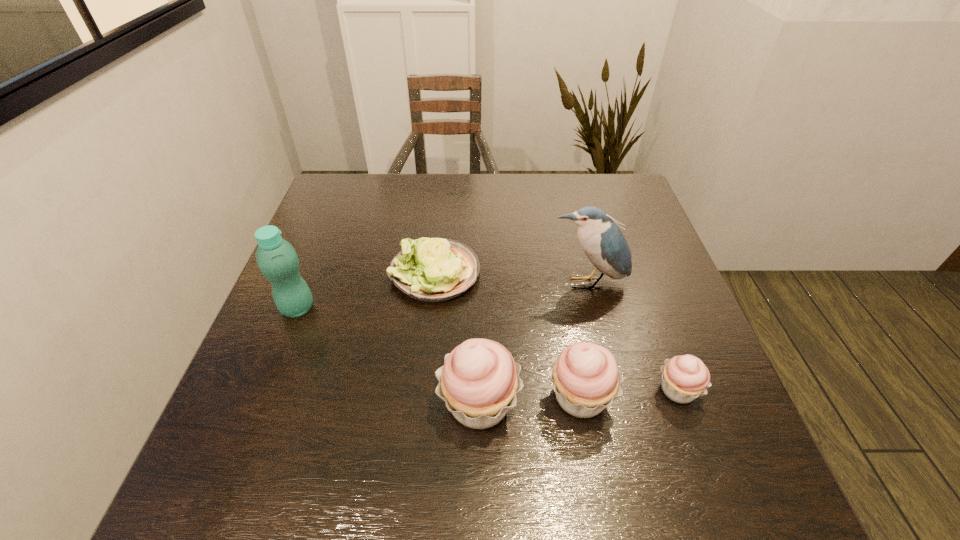
Locate an element on the screen. The width and height of the screenshot is (960, 540). vacant space at the left edge is located at coordinates tap(300, 255).

In the image, there is a desktop. Identify the location of vacant space at the right edge. (634, 224).

In order to click on vacant space at the far left corner in this screenshot , I will do `click(347, 190)`.

In the image, there is a desktop. In order to click on vacant space at the far right corner in this screenshot , I will do `click(593, 203)`.

The image size is (960, 540). I want to click on vacant space at the near right corner, so click(714, 433).

This screenshot has width=960, height=540. Find the location of `vacant space that's between the second tallest cupcake and the leftmost object`. vacant space that's between the second tallest cupcake and the leftmost object is located at coordinates (439, 352).

At what (x,y) coordinates should I click in order to perform the action: click on blank region between the leftmost object and the second shortest cupcake. Please return your answer as a coordinate pair (x, y). The height and width of the screenshot is (540, 960). Looking at the image, I should click on (439, 352).

Where is `empty space between the second cupcake from left to right and the shortest object`? The height and width of the screenshot is (540, 960). empty space between the second cupcake from left to right and the shortest object is located at coordinates (507, 335).

At what (x,y) coordinates should I click in order to perform the action: click on vacant area that lies between the lettuce and the shortest cupcake. Please return your answer as a coordinate pair (x, y). The width and height of the screenshot is (960, 540). Looking at the image, I should click on (557, 332).

In order to click on vacant space that is in between the third shortest object and the leftmost cupcake in this screenshot , I will do `click(530, 400)`.